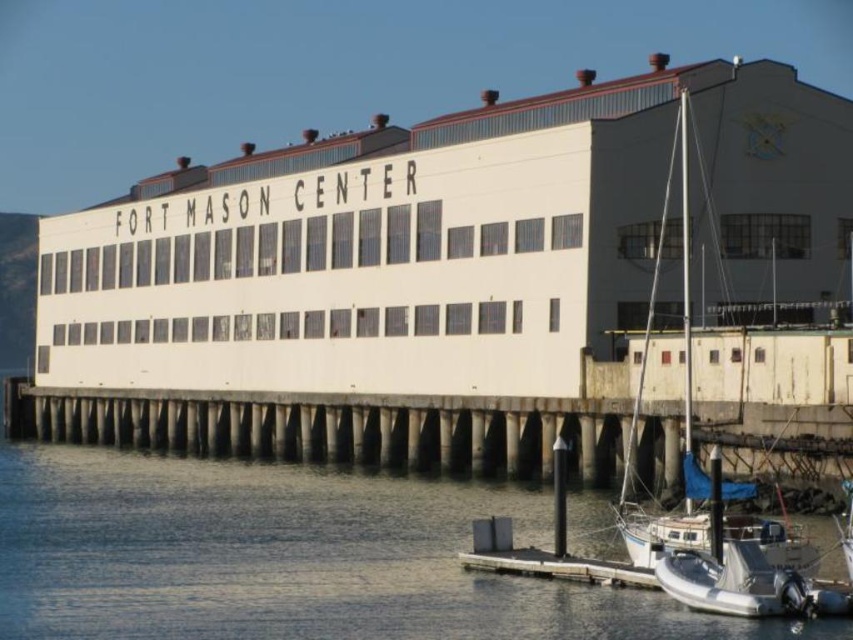
Question: Which of these objects is positioned closest to the clear water at lower left?

Choices:
 (A) concrete pillars at lower center
 (B) white matte sailboat at lower right

Answer: (A)

Question: In this image, where is concrete pillars at lower center located relative to white matte sailboat at lower right?

Choices:
 (A) left
 (B) right

Answer: (A)

Question: Can you confirm if concrete pillars at lower center is smaller than white matte sailboat at lower right?

Choices:
 (A) yes
 (B) no

Answer: (B)

Question: Does clear water at lower left appear on the right side of concrete pillars at lower center?

Choices:
 (A) yes
 (B) no

Answer: (B)

Question: Which point appears farthest from the camera in this image?

Choices:
 (A) (345, 432)
 (B) (366, 557)
 (C) (656, 262)

Answer: (A)

Question: Which point is farther to the camera?

Choices:
 (A) clear water at lower left
 (B) white matte sailboat at lower right
 (C) concrete pillars at lower center

Answer: (C)